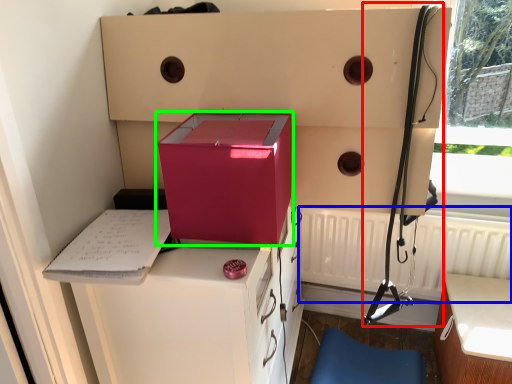
Question: Which object is the farthest from twin (highlighted by a red box)? Choose among these: radiator (highlighted by a blue box) or box (highlighted by a green box).

Choices:
 (A) radiator
 (B) box

Answer: (B)